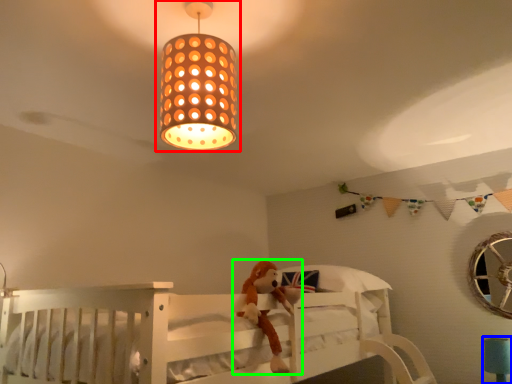
Question: Estimate the real-world distances between objects in this image. Which object is closer to lamp (highlighted by a red box), table lamp (highlighted by a blue box) or toy (highlighted by a green box)?

Choices:
 (A) table lamp
 (B) toy

Answer: (B)